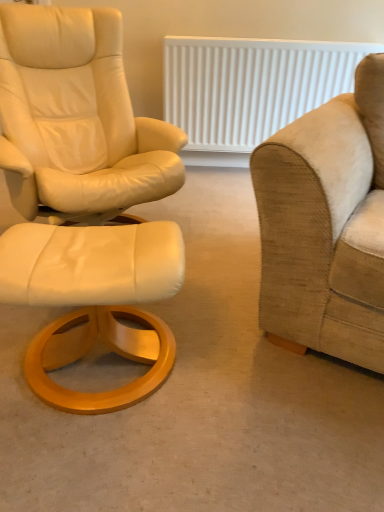
Question: Is white textured radiator at upper center in front of or behind white leather ottoman at left in the image?

Choices:
 (A) behind
 (B) front

Answer: (A)

Question: Is white textured radiator at upper center taller or shorter than white leather ottoman at left?

Choices:
 (A) short
 (B) tall

Answer: (B)

Question: Which of these objects is positioned farthest from the white textured radiator at upper center?

Choices:
 (A) matte white ottoman at left
 (B) white leather ottoman at left
 (C) beige fabric couch at right

Answer: (B)

Question: Which object is the closest to the matte white ottoman at left?

Choices:
 (A) white textured radiator at upper center
 (B) beige fabric couch at right
 (C) white leather ottoman at left

Answer: (C)